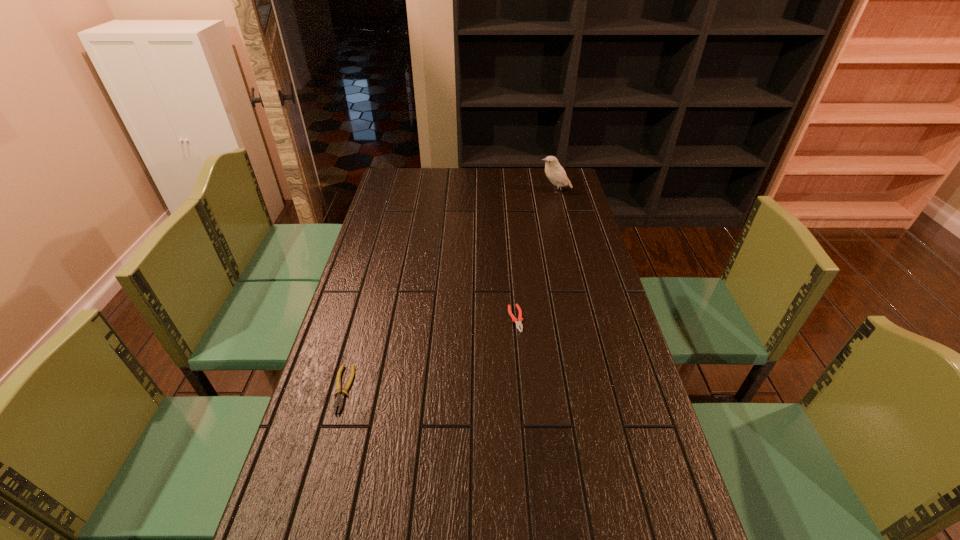
I want to click on bird, so click(554, 171).

You are a GUI agent. You are given a task and a screenshot of the screen. Output one action in this format:
    pyautogui.click(x=<x>, y=<y>)
    Task: Click on the rightmost object
    This screenshot has height=540, width=960.
    Given the screenshot: What is the action you would take?
    pyautogui.click(x=554, y=171)

Locate an element on the screen. the nearest object is located at coordinates (339, 400).

At what (x,y) coordinates should I click in order to perform the action: click on the left pliers. Please return your answer as a coordinate pair (x, y). Looking at the image, I should click on (339, 400).

Where is `the second farthest object`? The image size is (960, 540). the second farthest object is located at coordinates (518, 323).

Identify the location of the second object from right to left. (518, 323).

Where is `vacant space situated 0.270m at the beak of the bird`? The height and width of the screenshot is (540, 960). vacant space situated 0.270m at the beak of the bird is located at coordinates (476, 191).

This screenshot has height=540, width=960. I want to click on vacant space located 0.070m at the beak of the bird, so click(x=522, y=191).

Find the location of a particular element. The width and height of the screenshot is (960, 540). vacant space situated at the beak of the bird is located at coordinates 469,191.

Where is `free space located on the front of the left pliers`? The width and height of the screenshot is (960, 540). free space located on the front of the left pliers is located at coordinates (316, 483).